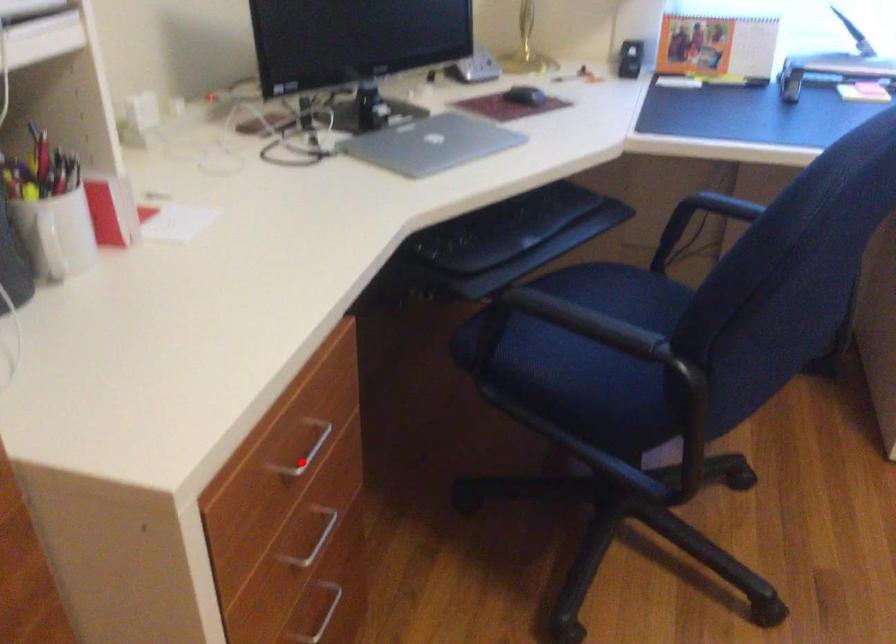
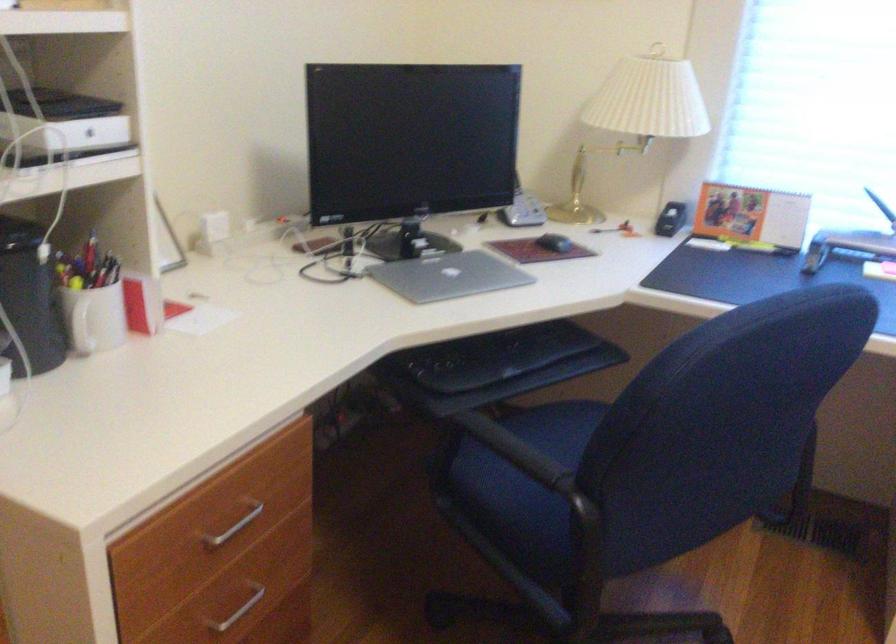
Locate, in the second image, the point that corresponds to the highlighted location in the first image.

(231, 527)